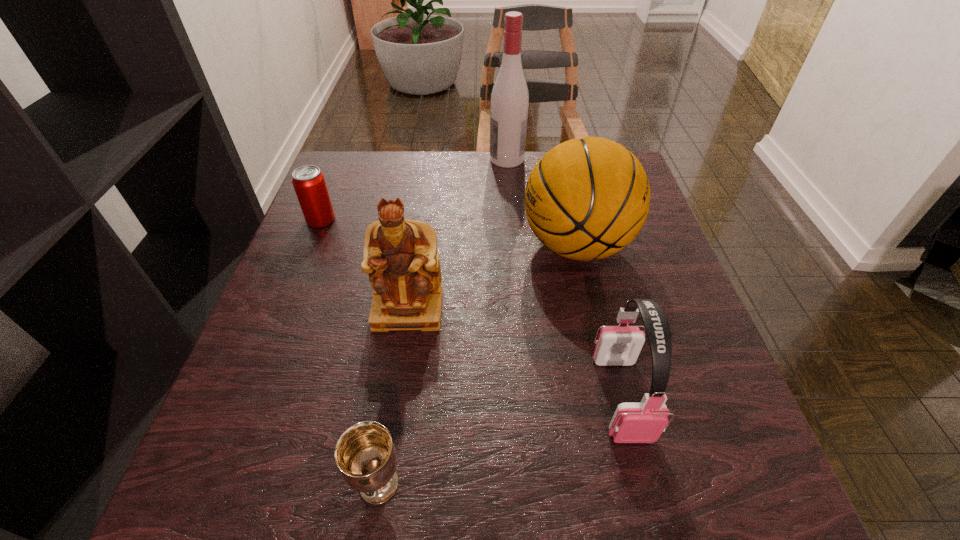
The image size is (960, 540). Find the location of `free region located on the label of the farthest object`. free region located on the label of the farthest object is located at coordinates (462, 159).

Locate an element on the screen. This screenshot has width=960, height=540. vacant space located 0.280m on the surface of the basketball near the brand logo is located at coordinates (398, 245).

Where is `blank area located on the surface of the basketball near the brand logo`? The height and width of the screenshot is (540, 960). blank area located on the surface of the basketball near the brand logo is located at coordinates (376, 245).

This screenshot has height=540, width=960. I want to click on free point located on the surface of the basketball near the brand logo, so click(460, 245).

Locate an element on the screen. This screenshot has height=540, width=960. vacant area situated 0.160m on the front-facing side of the figurine is located at coordinates (393, 410).

Where is `vacant space located on the outer surface of the second nearest object`? The width and height of the screenshot is (960, 540). vacant space located on the outer surface of the second nearest object is located at coordinates (641, 478).

Find the location of `vacant space located 0.180m on the back of the can`. vacant space located 0.180m on the back of the can is located at coordinates (341, 171).

At what (x,y) coordinates should I click in order to perform the action: click on free point located on the back of the nearest object. Please return your answer as a coordinate pair (x, y). Looking at the image, I should click on (396, 368).

In order to click on object that is at the far edge in this screenshot , I will do `click(509, 103)`.

This screenshot has width=960, height=540. I want to click on object present at the near edge, so click(x=364, y=453).